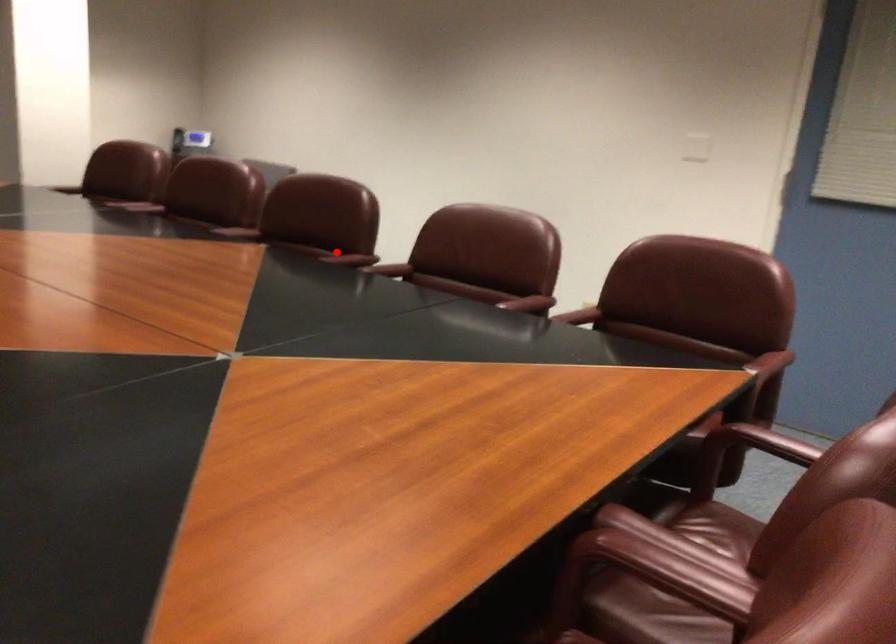
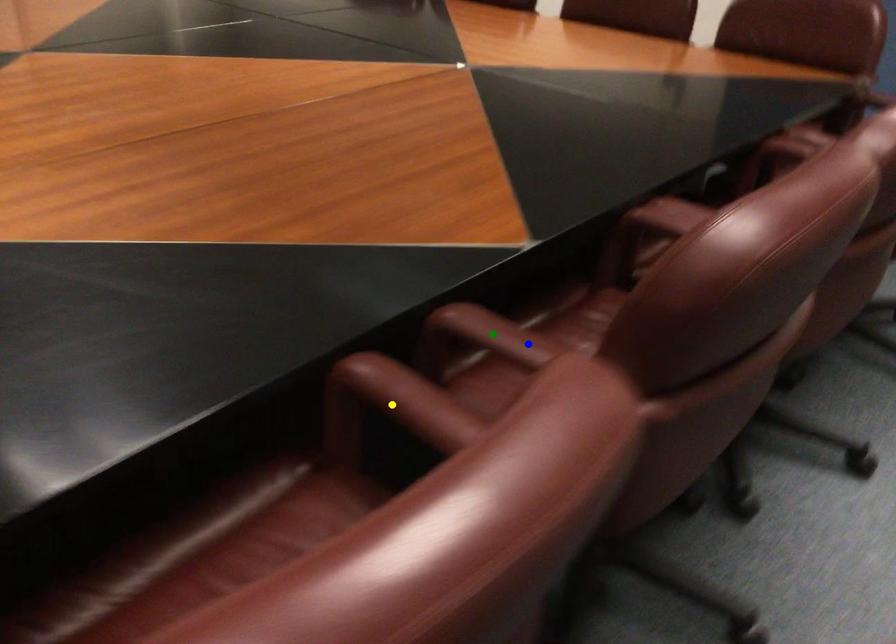
Question: I am providing you with two images of the same scene from different viewpoints. A red point is marked on the first image. You are given multiple points on the second image. Which point in image 2 represents the same 3d spot as the red point in image 1?

Choices:
 (A) yellow point
 (B) blue point
 (C) green point

Answer: (C)